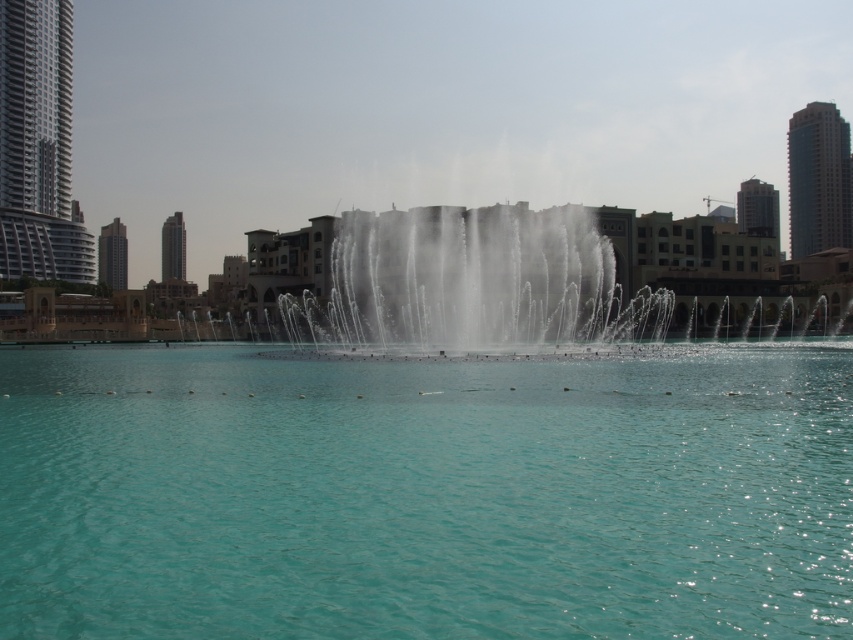
You are standing at the point with coordinates (425, 493) in the image. What do you see directly in front of you?

You see clear blue water at center directly in front of you at point (425, 493).

You are standing in the urban scene and want to take a photo of both the point at coordinates point (248, 468) and the point at coordinates point (368, 260). Which point will appear larger in your photo?

Point (248, 468) is closer to the camera than point (368, 260), so it will appear larger in the photo.

You are a city planner analyzing the layout of this urban area. The clear blue water at center is a key feature. Where exactly is this feature located in terms of coordinates?

The clear blue water at center is located at the coordinates point (425, 493).